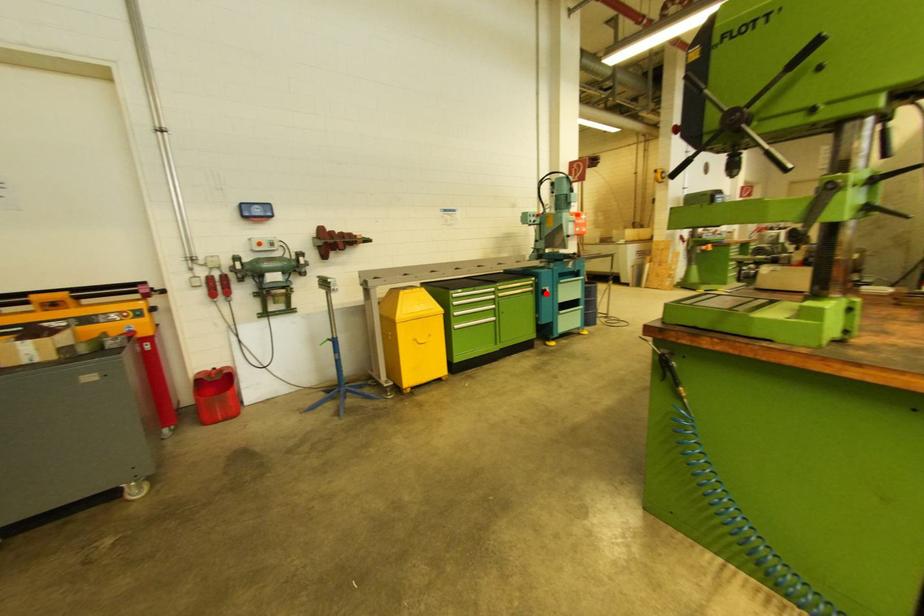
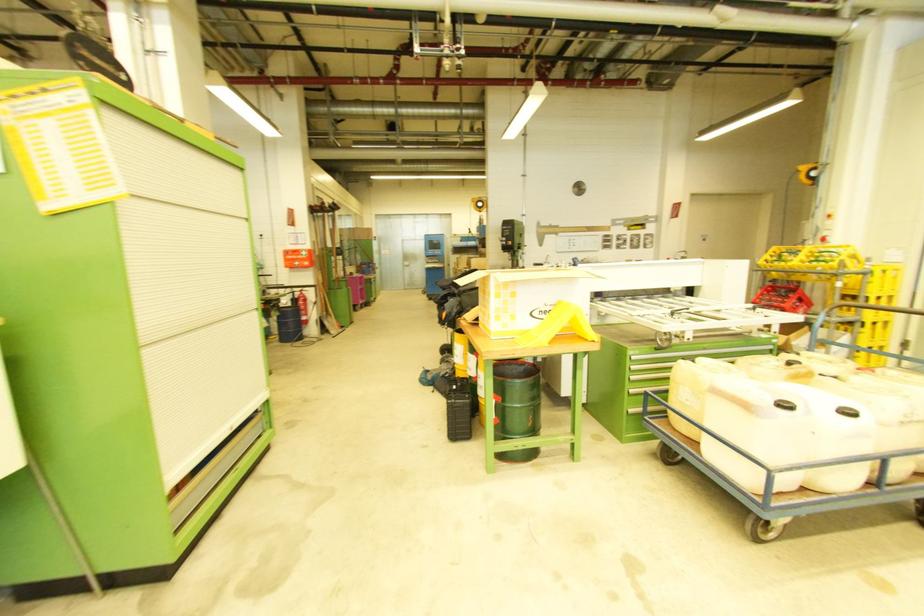
Question: I am providing you with two images of the same scene from different viewpoints. A red point is marked on the first image. At the location where the point appears in image 1, is it still visible in image 2?

Choices:
 (A) Yes
 (B) No

Answer: (B)